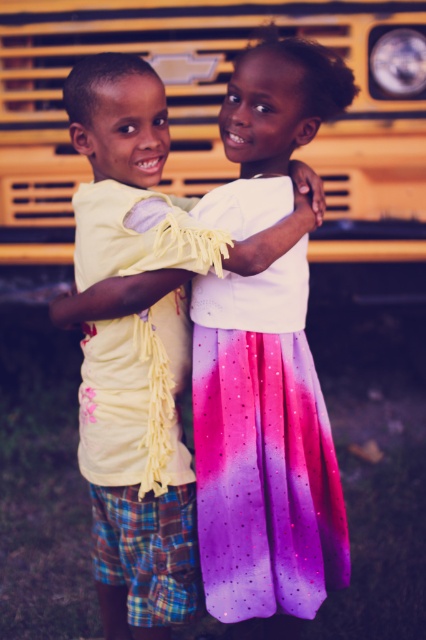
Who is shorter, matte yellow shirt at center or shiny ombre skirt at center?

With less height is shiny ombre skirt at center.

Between matte yellow shirt at center and shiny ombre skirt at center, which one appears on the right side from the viewer's perspective?

shiny ombre skirt at center

The image size is (426, 640). What do you see at coordinates (264, 452) in the screenshot?
I see `matte yellow shirt at center` at bounding box center [264, 452].

Where is `matte yellow shirt at center`? The image size is (426, 640). matte yellow shirt at center is located at coordinates (264, 452).